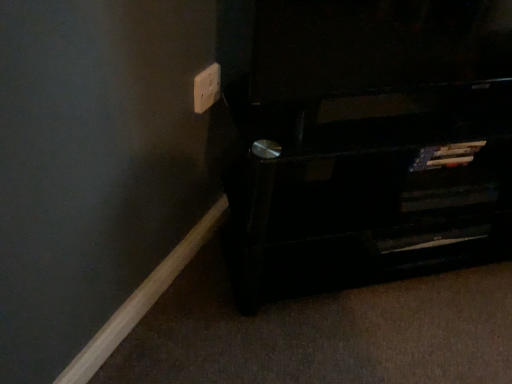
Locate an element on the screen. The image size is (512, 384). empty space that is ontop of black wood shelf at lower right (from a real-world perspective) is located at coordinates (414, 101).